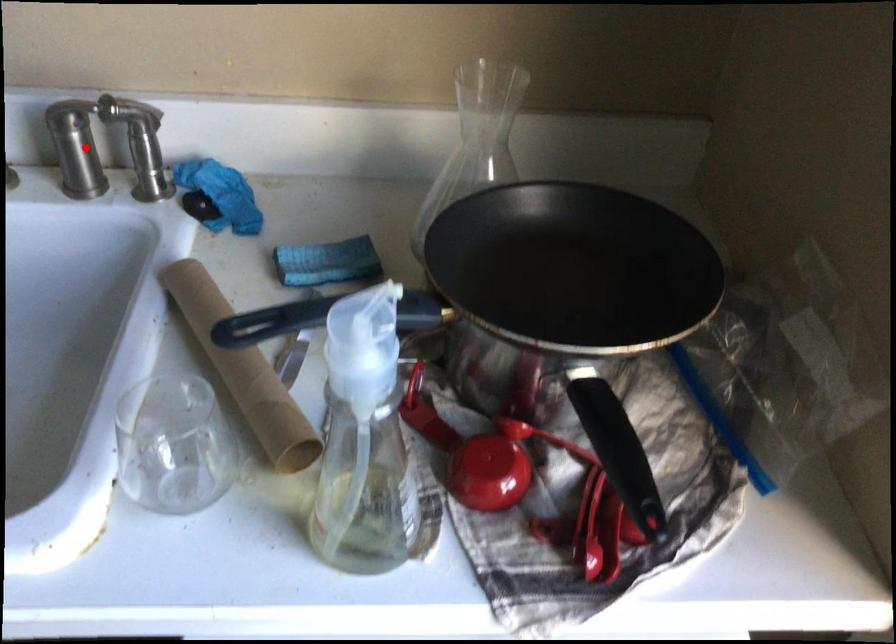
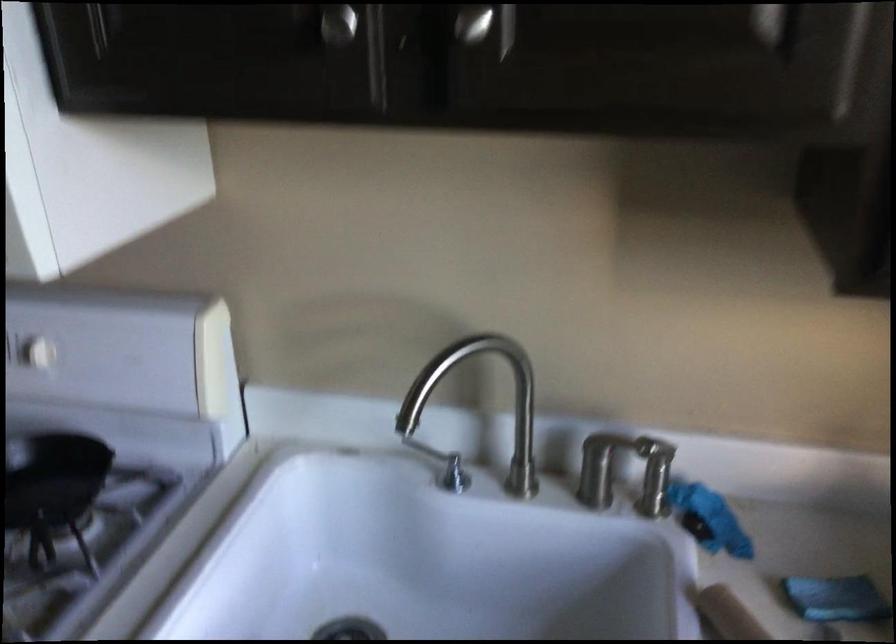
The point at the highlighted location is marked in the first image. Where is the corresponding point in the second image?

(606, 465)